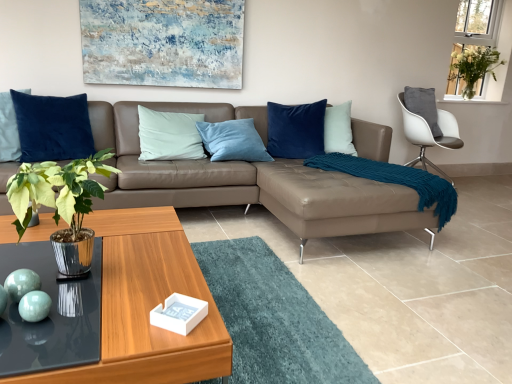
The width and height of the screenshot is (512, 384). Find the location of `vacant space in front of teal glossy sphere at lower left, which appears as the first teal when viewed from the right`. vacant space in front of teal glossy sphere at lower left, which appears as the first teal when viewed from the right is located at coordinates (27, 343).